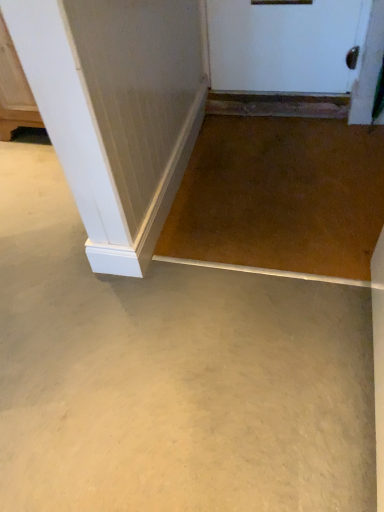
Question: In terms of size, does smooth concrete floor at center appear bigger or smaller than clear glass screen door at upper right?

Choices:
 (A) small
 (B) big

Answer: (B)

Question: From the image's perspective, is smooth concrete floor at center located above or below clear glass screen door at upper right?

Choices:
 (A) below
 (B) above

Answer: (A)

Question: Is smooth concrete floor at center wider or thinner than clear glass screen door at upper right?

Choices:
 (A) thin
 (B) wide

Answer: (B)

Question: From the image's perspective, is clear glass screen door at upper right above or below smooth concrete floor at center?

Choices:
 (A) below
 (B) above

Answer: (B)

Question: From a real-world perspective, relative to smooth concrete floor at center, is clear glass screen door at upper right vertically above or below?

Choices:
 (A) below
 (B) above

Answer: (B)

Question: Considering the positions of clear glass screen door at upper right and smooth concrete floor at center in the image, is clear glass screen door at upper right bigger or smaller than smooth concrete floor at center?

Choices:
 (A) big
 (B) small

Answer: (B)

Question: Does point (362, 49) appear closer or farther from the camera than point (132, 464)?

Choices:
 (A) farther
 (B) closer

Answer: (A)